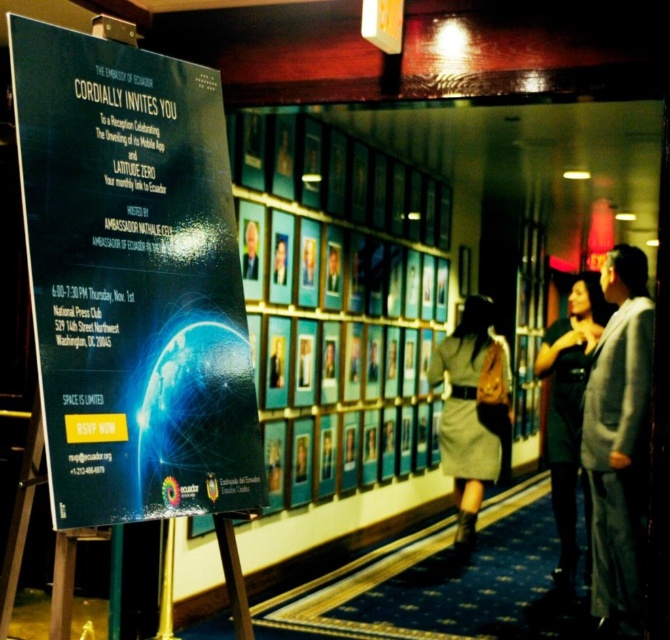
Between matte black poster at center and light brown fabric skirt at center, which one has less height?

matte black poster at center is shorter.

In the scene shown: Can you confirm if matte black poster at center is positioned below light brown fabric skirt at center?

Incorrect, matte black poster at center is not positioned below light brown fabric skirt at center.

Is point (60, 368) more distant than point (507, 444)?

No.

I want to click on matte black poster at center, so click(x=133, y=282).

How much distance is there between light brown fabric skirt at center and black dress at center?

They are 13.54 inches apart.

Is point (446, 364) farther from viewer compared to point (586, 278)?

That is True.

Find the location of a particular element. The image size is (670, 640). light brown fabric skirt at center is located at coordinates (472, 412).

Between matte black poster at center and black dress at center, which one appears on the left side from the viewer's perspective?

From the viewer's perspective, matte black poster at center appears more on the left side.

Can you confirm if matte black poster at center is positioned below black dress at center?

No.

Is point (117, 48) less distant than point (574, 554)?

That is True.

You are a GUI agent. You are given a task and a screenshot of the screen. Output one action in this format:
    pyautogui.click(x=<x>, y=<y>)
    Task: Click on the matte black poster at center
    The height and width of the screenshot is (640, 670).
    Given the screenshot: What is the action you would take?
    pyautogui.click(x=133, y=282)